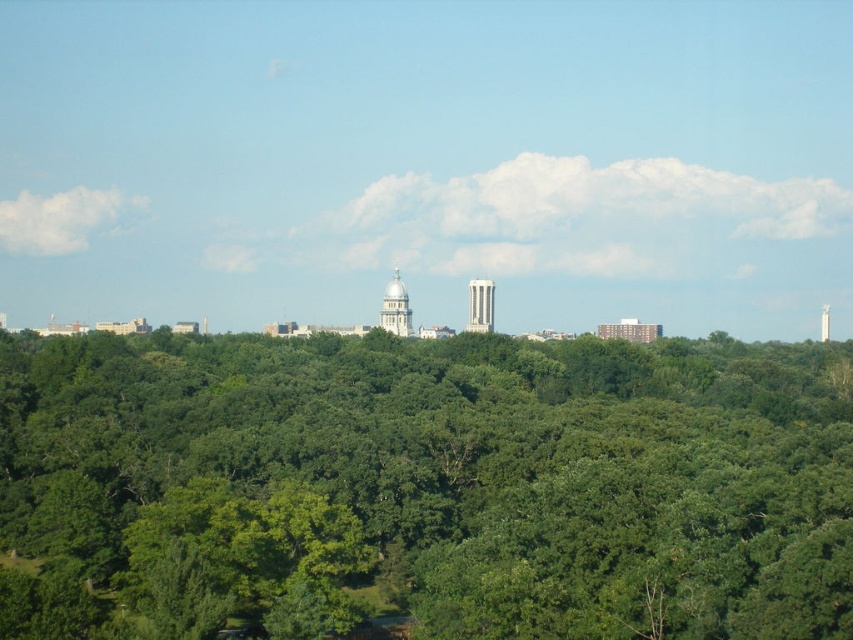
Question: Is the position of white glossy water tower at center more distant than that of white smooth water tower at upper center?

Choices:
 (A) yes
 (B) no

Answer: (B)

Question: Does green leafy forest at center appear on the right side of white smooth water tower at upper center?

Choices:
 (A) yes
 (B) no

Answer: (B)

Question: Among these objects, which one is farthest from the camera?

Choices:
 (A) white smooth water tower at upper center
 (B) white smooth tower at center
 (C) green leafy forest at center
 (D) white glossy water tower at center

Answer: (A)

Question: Estimate the real-world distances between objects in this image. Which object is farther from the white smooth water tower at upper center?

Choices:
 (A) green leafy forest at center
 (B) white glossy water tower at center

Answer: (B)

Question: Does white glossy water tower at center appear on the right side of white smooth tower at center?

Choices:
 (A) yes
 (B) no

Answer: (B)

Question: Estimate the real-world distances between objects in this image. Which object is farther from the white smooth tower at center?

Choices:
 (A) green leafy forest at center
 (B) white smooth water tower at upper center

Answer: (B)